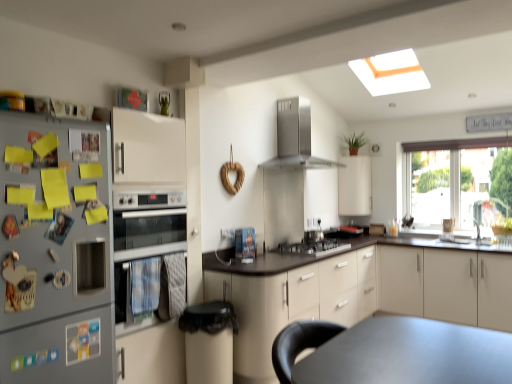
Question: Can you confirm if satin silver cooktop at center is smaller than satin silver gas stove at center?

Choices:
 (A) no
 (B) yes

Answer: (B)

Question: Does satin silver cooktop at center come in front of satin silver gas stove at center?

Choices:
 (A) yes
 (B) no

Answer: (B)

Question: Does satin silver cooktop at center appear on the left side of satin silver gas stove at center?

Choices:
 (A) no
 (B) yes

Answer: (A)

Question: From a real-world perspective, is satin silver cooktop at center physically below satin silver gas stove at center?

Choices:
 (A) yes
 (B) no

Answer: (B)

Question: Is satin silver cooktop at center surrounding satin silver gas stove at center?

Choices:
 (A) yes
 (B) no

Answer: (B)

Question: From the image's perspective, is black plastic trash can at lower center located above or below beige matte cabinet at center, the 1th cabinetry from the left?

Choices:
 (A) below
 (B) above

Answer: (A)

Question: Choose the correct answer: Is black plastic trash can at lower center inside beige matte cabinet at center, acting as the third cabinetry starting from the right, or outside it?

Choices:
 (A) outside
 (B) inside

Answer: (A)

Question: From a real-world perspective, is black plastic trash can at lower center positioned above or below beige matte cabinet at center, the 1th cabinetry from the left?

Choices:
 (A) above
 (B) below

Answer: (B)

Question: Is black plastic trash can at lower center to the left or to the right of beige matte cabinet at center, acting as the third cabinetry starting from the right, in the image?

Choices:
 (A) right
 (B) left

Answer: (B)

Question: Considering the positions of satin silver gas stove at center and beige matte cabinet at center, acting as the third cabinetry starting from the right, in the image, is satin silver gas stove at center bigger or smaller than beige matte cabinet at center, acting as the third cabinetry starting from the right,?

Choices:
 (A) small
 (B) big

Answer: (A)

Question: Is point (276, 246) closer or farther from the camera than point (309, 304)?

Choices:
 (A) farther
 (B) closer

Answer: (A)

Question: Would you say satin silver gas stove at center is to the left or to the right of beige matte cabinet at center, the 1th cabinetry from the left, in the picture?

Choices:
 (A) left
 (B) right

Answer: (A)

Question: From the image's perspective, is satin silver gas stove at center above or below beige matte cabinet at center, the 1th cabinetry from the left?

Choices:
 (A) above
 (B) below

Answer: (A)

Question: From a real-world perspective, is satin silver cooktop at center positioned above or below beige matte cabinet at right, the first cabinetry positioned from the right?

Choices:
 (A) above
 (B) below

Answer: (A)

Question: Visually, is satin silver cooktop at center positioned to the left or to the right of beige matte cabinet at right, the first cabinetry positioned from the right?

Choices:
 (A) left
 (B) right

Answer: (A)